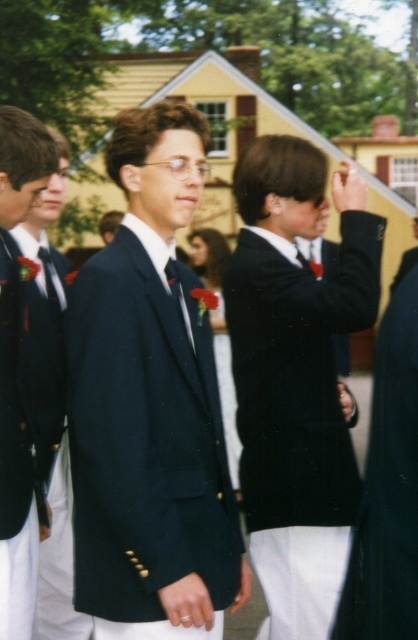
Consider the image. You are a photographer positioned in front of the yellow building with red shutters. You notice two gentlemen wearing a navy blue suit at center and a matte black blazer at center. Which gentleman should you focus on first if you want to capture the one closer to you?

The navy blue suit at center is closer to the viewer than the matte black blazer at center, so you should focus on the navy blue suit at center first.

You are a photographer who needs to capture a group photo of the navy blue suit at center and the matte black blazer at left. Since you want both subjects to be clearly visible, which one should you focus on first to ensure proper exposure, considering their positions?

The navy blue suit at center is positioned under the matte black blazer at left, so you should focus on the navy blue suit at center first to ensure it is properly exposed before adjusting for the matte black blazer at left.

You are a photographer at a school event. You need to arrange the navy blue suit at center and the matte black blazer at left in a group photo so that both are visible. Given their sizes, which one should you place closer to the camera to ensure both are equally visible?

The navy blue suit at center is larger in size compared to the matte black blazer at left. To ensure both are equally visible in the photo, the matte black blazer at left should be placed closer to the camera since it is smaller and needs to appear larger in the frame to match the size of the navy blue suit at center.